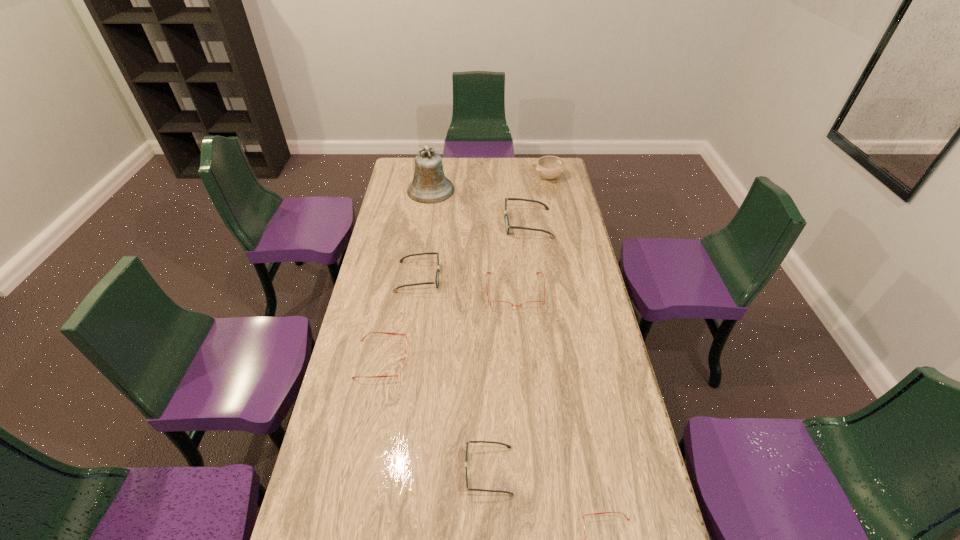
Find the location of a particular element. The image size is (960, 540). the leftmost pink spectacles is located at coordinates (402, 367).

The image size is (960, 540). Identify the location of the second smallest pink spectacles. (402, 367).

Locate an element on the screen. free space located 0.240m on the right of the tallest object is located at coordinates (x=503, y=190).

Find the location of `blank space located on the left of the bowl`. blank space located on the left of the bowl is located at coordinates (486, 178).

Where is `free region located on the face of the farthest spectacles`? This screenshot has width=960, height=540. free region located on the face of the farthest spectacles is located at coordinates (444, 224).

I want to click on free space located on the face of the farthest spectacles, so click(x=451, y=224).

Find the location of a particular element. This screenshot has height=540, width=960. vacant region located on the face of the farthest spectacles is located at coordinates (444, 224).

Where is `vacant point located 0.260m on the face of the second nearest gray spectacles`? The width and height of the screenshot is (960, 540). vacant point located 0.260m on the face of the second nearest gray spectacles is located at coordinates (506, 277).

At what (x,y) coordinates should I click in order to perform the action: click on blank area located 0.190m on the lenses of the farthest pink spectacles. Please return your answer as a coordinate pair (x, y). The width and height of the screenshot is (960, 540). Looking at the image, I should click on (520, 355).

Locate an element on the screen. This screenshot has width=960, height=540. vacant space located on the face of the fifth farthest spectacles is located at coordinates (424, 471).